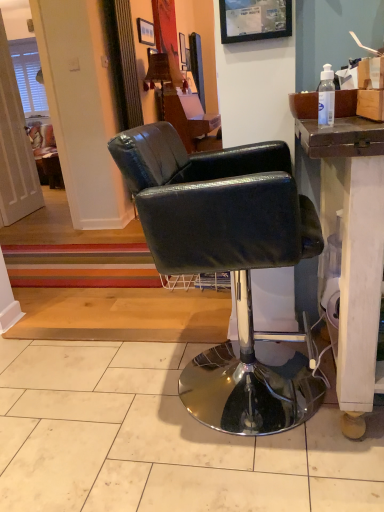
Question: Considering the relative sizes of black leather chair at center and transparent plastic bottle at upper right in the image provided, is black leather chair at center shorter than transparent plastic bottle at upper right?

Choices:
 (A) no
 (B) yes

Answer: (A)

Question: Is the depth of black leather chair at center less than that of transparent plastic bottle at upper right?

Choices:
 (A) yes
 (B) no

Answer: (A)

Question: Can you confirm if black leather chair at center is thinner than transparent plastic bottle at upper right?

Choices:
 (A) yes
 (B) no

Answer: (B)

Question: Does black leather chair at center appear on the left side of transparent plastic bottle at upper right?

Choices:
 (A) no
 (B) yes

Answer: (B)

Question: Is transparent plastic bottle at upper right inside black leather chair at center?

Choices:
 (A) no
 (B) yes

Answer: (A)

Question: Do you think wooden lampshade at upper center is within transparent plastic bottle at upper right, or outside of it?

Choices:
 (A) inside
 (B) outside

Answer: (B)

Question: Is wooden lampshade at upper center in front of or behind transparent plastic bottle at upper right in the image?

Choices:
 (A) behind
 (B) front

Answer: (A)

Question: From the image's perspective, is wooden lampshade at upper center located above or below transparent plastic bottle at upper right?

Choices:
 (A) below
 (B) above

Answer: (B)

Question: Is point (168, 80) closer or farther from the camera than point (332, 117)?

Choices:
 (A) farther
 (B) closer

Answer: (A)

Question: Considering the positions of brown cardboard box at upper right and black leather chair at center in the image, is brown cardboard box at upper right taller or shorter than black leather chair at center?

Choices:
 (A) tall
 (B) short

Answer: (B)

Question: Is brown cardboard box at upper right wider or thinner than black leather chair at center?

Choices:
 (A) wide
 (B) thin

Answer: (B)

Question: Is brown cardboard box at upper right in front of or behind black leather chair at center in the image?

Choices:
 (A) front
 (B) behind

Answer: (B)

Question: Does point (347, 90) appear closer or farther from the camera than point (266, 381)?

Choices:
 (A) closer
 (B) farther

Answer: (A)

Question: From the image's perspective, is black leather chair at center located above or below matte black picture frame at upper center, which is counted as the 2th picture frame, starting from the right?

Choices:
 (A) above
 (B) below

Answer: (B)

Question: Considering the positions of black leather chair at center and matte black picture frame at upper center, which is counted as the 1th picture frame, starting from the back, in the image, is black leather chair at center wider or thinner than matte black picture frame at upper center, which is counted as the 1th picture frame, starting from the back,?

Choices:
 (A) thin
 (B) wide

Answer: (B)